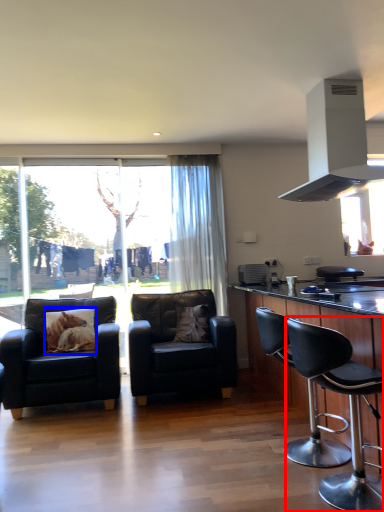
Question: Among these objects, which one is nearest to the camera, chair (highlighted by a red box) or pillow (highlighted by a blue box)?

Choices:
 (A) chair
 (B) pillow

Answer: (A)